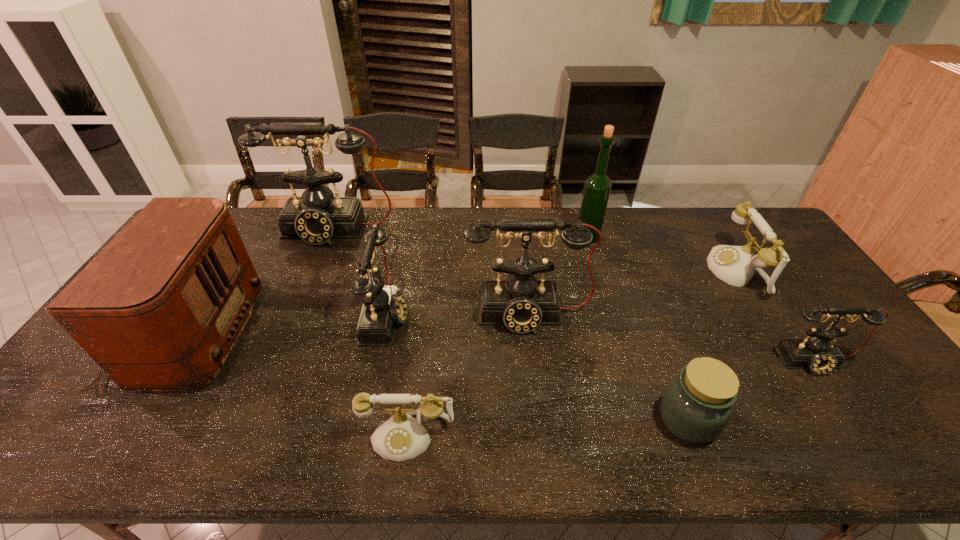
Identify the location of the right white telephone. (735, 265).

Image resolution: width=960 pixels, height=540 pixels. What are the coordinates of `jar` in the screenshot? It's located at (696, 406).

Image resolution: width=960 pixels, height=540 pixels. Find the location of `the left white telephone`. the left white telephone is located at coordinates (402, 437).

You are a GUI agent. You are given a task and a screenshot of the screen. Output one action in this format:
    pyautogui.click(x=<x>, y=<y>)
    Task: Click on the nearest telephone
    This screenshot has width=960, height=540.
    Given the screenshot: What is the action you would take?
    pyautogui.click(x=402, y=437)

The image size is (960, 540). In order to click on free space located 0.210m on the front of the liquor in this screenshot , I will do `click(602, 287)`.

The height and width of the screenshot is (540, 960). Identify the location of free space located on the dial of the tallest telephone. tap(302, 308).

The height and width of the screenshot is (540, 960). Find the location of `free space located on the dial of the second black telephone from right to left`. free space located on the dial of the second black telephone from right to left is located at coordinates (542, 443).

Find the location of `free space located on the front panel of the radio receiver`. free space located on the front panel of the radio receiver is located at coordinates (348, 333).

The width and height of the screenshot is (960, 540). I want to click on vacant point located 0.240m on the dial of the second smallest black telephone, so click(x=492, y=314).

This screenshot has height=540, width=960. What are the coordinates of `vacant space situated on the dial of the rightmost black telephone` in the screenshot? It's located at (856, 423).